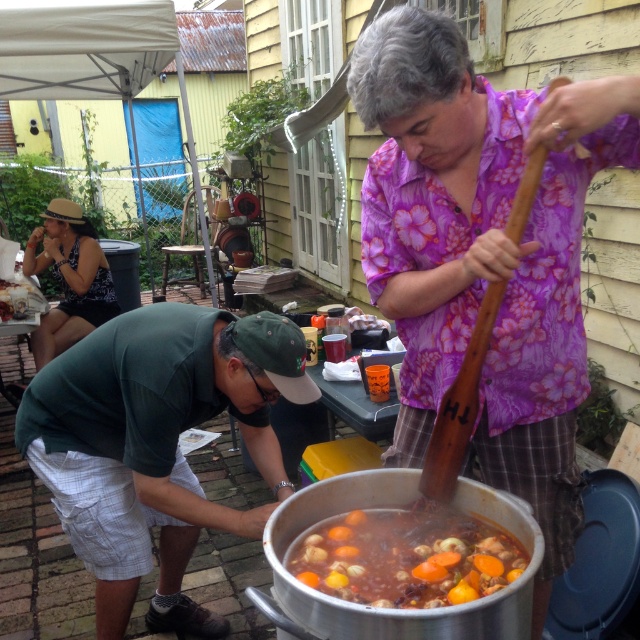
Between point (547, 321) and point (467, 522), which one is positioned behind?

The point (467, 522) is behind.

Which is more to the right, green fabric cap at center or carrot-studded broth at center?

green fabric cap at center is more to the right.

You are a GUI agent. You are given a task and a screenshot of the screen. Output one action in this format:
    pyautogui.click(x=<x>, y=<y>)
    Task: Click on the green fabric cap at center
    This screenshot has height=640, width=640.
    Given the screenshot: What is the action you would take?
    pyautogui.click(x=484, y=252)

I want to click on carrot-studded broth at center, so click(406, 557).

Does green fabric shirt at lower left have a larger size compared to matte black tank top at left?

Yes, green fabric shirt at lower left is bigger than matte black tank top at left.

Is point (244, 529) closer to viewer compared to point (29, 336)?

Yes, point (244, 529) is in front of point (29, 336).

Is point (268, 429) less distant than point (68, 248)?

Yes.

Where is `green fabric shirt at lower left`? green fabric shirt at lower left is located at coordinates (156, 444).